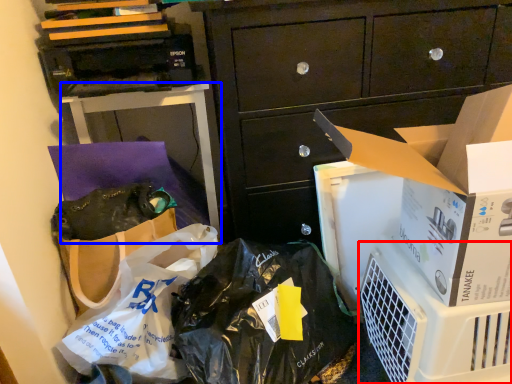
Question: Which object is further to the camera taking this photo, appliance (highlighted by a red box) or desk (highlighted by a blue box)?

Choices:
 (A) appliance
 (B) desk

Answer: (B)